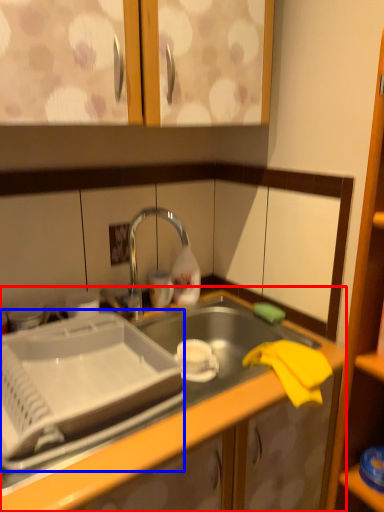
Question: Which object appears farthest to the camera in this image, countertop (highlighted by a red box) or appliance (highlighted by a blue box)?

Choices:
 (A) countertop
 (B) appliance

Answer: (B)